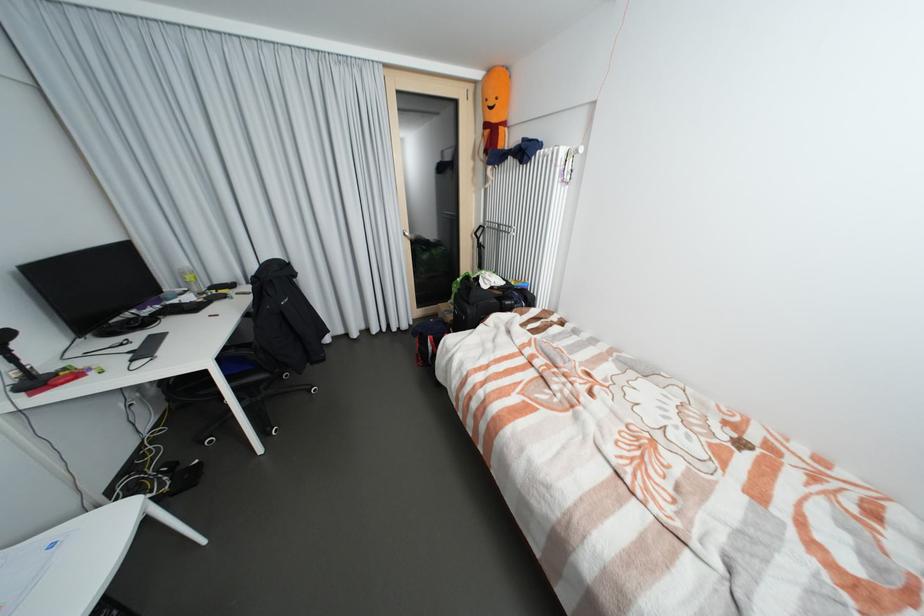
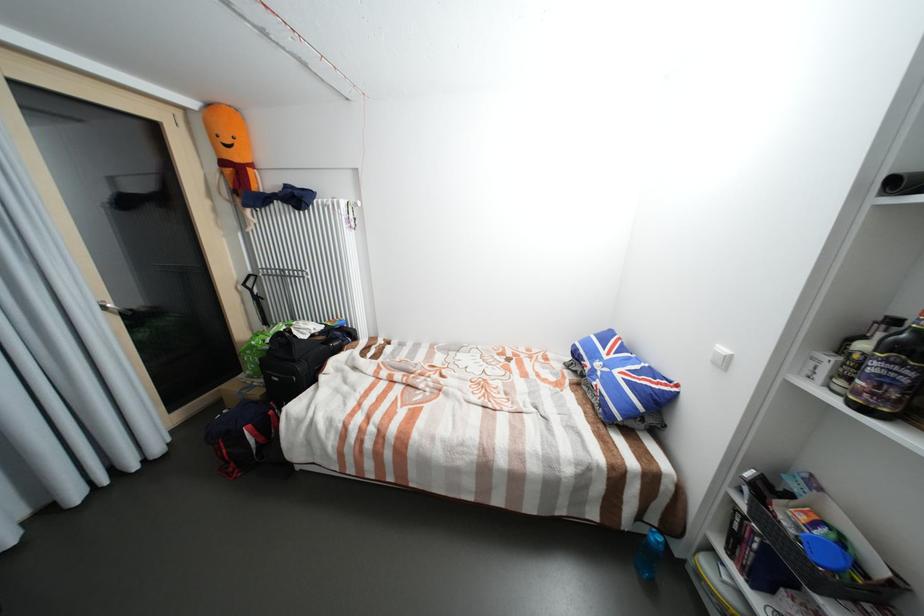
The point at (x=492, y=126) is marked in the first image. Where is the corresponding point in the second image?

(229, 163)